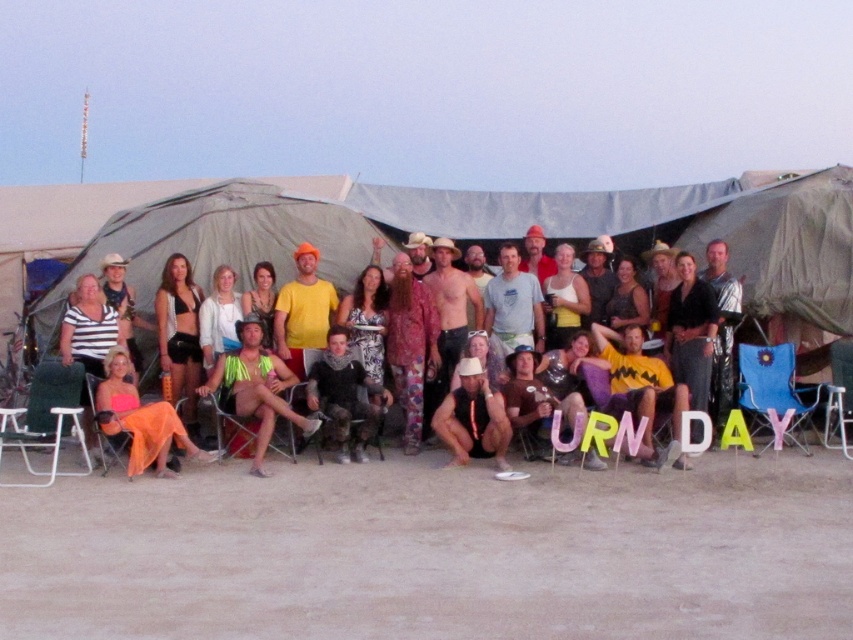
You are a GUI agent. You are given a task and a screenshot of the screen. Output one action in this format:
    pyautogui.click(x=<x>, y=<y>)
    Task: Click on the matte black bikini at center
    The height and width of the screenshot is (640, 853).
    Given the screenshot: What is the action you would take?
    pyautogui.click(x=178, y=333)

Can you confirm if matte black bikini at center is bigger than metallic silver beach chair at lower right?

Yes.

Where is `matte black bikini at center`? The image size is (853, 640). matte black bikini at center is located at coordinates (178, 333).

Find the location of a particular element. The image size is (853, 640). matte black bikini at center is located at coordinates (178, 333).

Can you confirm if smooth sand at lower center is positioned to the left of neon green fabric at center?

In fact, smooth sand at lower center is to the right of neon green fabric at center.

Looking at this image, measure the distance between smooth sand at lower center and camera.

smooth sand at lower center and camera are 30.04 feet apart from each other.

Is point (503, 515) in front of point (268, 385)?

Yes, point (503, 515) is in front of point (268, 385).

This screenshot has width=853, height=640. I want to click on smooth sand at lower center, so click(434, 552).

This screenshot has height=640, width=853. What do you see at coordinates (345, 396) in the screenshot? I see `flannel shirt at center` at bounding box center [345, 396].

Who is higher up, flannel shirt at center or matte black bikini at center?

matte black bikini at center

Locate an element on the screen. Image resolution: width=853 pixels, height=640 pixels. flannel shirt at center is located at coordinates (345, 396).

You are a GUI agent. You are given a task and a screenshot of the screen. Output one action in this format:
    pyautogui.click(x=<x>, y=<y>)
    Task: Click on the flannel shirt at center
    This screenshot has height=640, width=853.
    Given the screenshot: What is the action you would take?
    pyautogui.click(x=345, y=396)